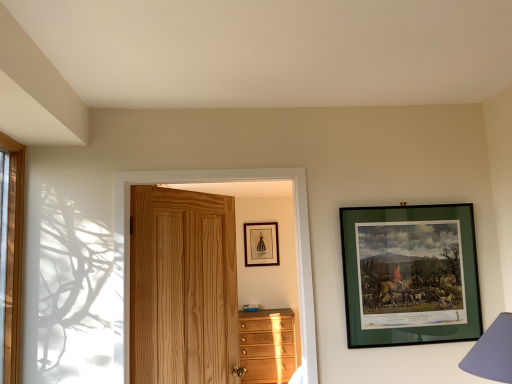
Question: Is matte black picture frame at upper center, arranged as the second picture frame when viewed from the right, outside of green matte picture frame at upper right, which is counted as the first picture frame, starting from the front?

Choices:
 (A) yes
 (B) no

Answer: (A)

Question: Is matte black picture frame at upper center, the 1th picture frame when ordered from back to front, to the right of green matte picture frame at upper right, the second picture frame from the left, from the viewer's perspective?

Choices:
 (A) yes
 (B) no

Answer: (B)

Question: Considering the relative positions of matte black picture frame at upper center, the first picture frame positioned from the left, and green matte picture frame at upper right, which is counted as the first picture frame, starting from the front, in the image provided, is matte black picture frame at upper center, the first picture frame positioned from the left, to the left of green matte picture frame at upper right, which is counted as the first picture frame, starting from the front, from the viewer's perspective?

Choices:
 (A) no
 (B) yes

Answer: (B)

Question: Is matte black picture frame at upper center, the first picture frame positioned from the left, aimed at green matte picture frame at upper right, which is counted as the first picture frame, starting from the front?

Choices:
 (A) yes
 (B) no

Answer: (A)

Question: Is there a large distance between matte black picture frame at upper center, the 1th picture frame when ordered from back to front, and green matte picture frame at upper right, the second picture frame from the left?

Choices:
 (A) yes
 (B) no

Answer: (A)

Question: Is matte black picture frame at upper center, the first picture frame positioned from the left, looking in the opposite direction of green matte picture frame at upper right, the 1th picture frame when ordered from right to left?

Choices:
 (A) no
 (B) yes

Answer: (A)

Question: Does purple fabric lampshade at lower right come behind natural wood door at center?

Choices:
 (A) yes
 (B) no

Answer: (B)

Question: From the image's perspective, is purple fabric lampshade at lower right over natural wood door at center?

Choices:
 (A) no
 (B) yes

Answer: (A)

Question: Is purple fabric lampshade at lower right next to natural wood door at center and touching it?

Choices:
 (A) no
 (B) yes

Answer: (A)

Question: From the image's perspective, would you say purple fabric lampshade at lower right is shown under natural wood door at center?

Choices:
 (A) no
 (B) yes

Answer: (B)

Question: Is purple fabric lampshade at lower right turned away from natural wood door at center?

Choices:
 (A) yes
 (B) no

Answer: (B)

Question: Does purple fabric lampshade at lower right appear on the left side of natural wood door at center?

Choices:
 (A) yes
 (B) no

Answer: (B)

Question: Does green matte picture frame at upper right, the 1th picture frame when ordered from right to left, have a lesser width compared to light brown wooden chest of drawers at lower center?

Choices:
 (A) yes
 (B) no

Answer: (A)